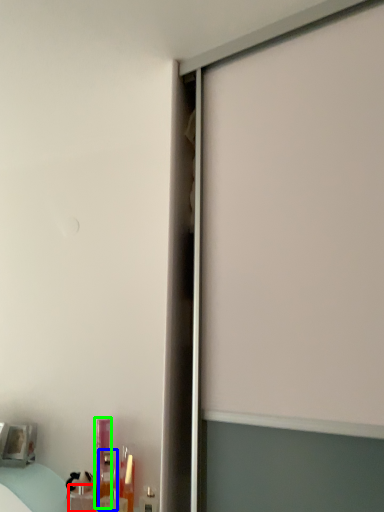
Question: Which is farther away from toiletry (highlighted by a red box)? toiletry (highlighted by a blue box) or toiletry (highlighted by a green box)?

Choices:
 (A) toiletry
 (B) toiletry

Answer: (B)